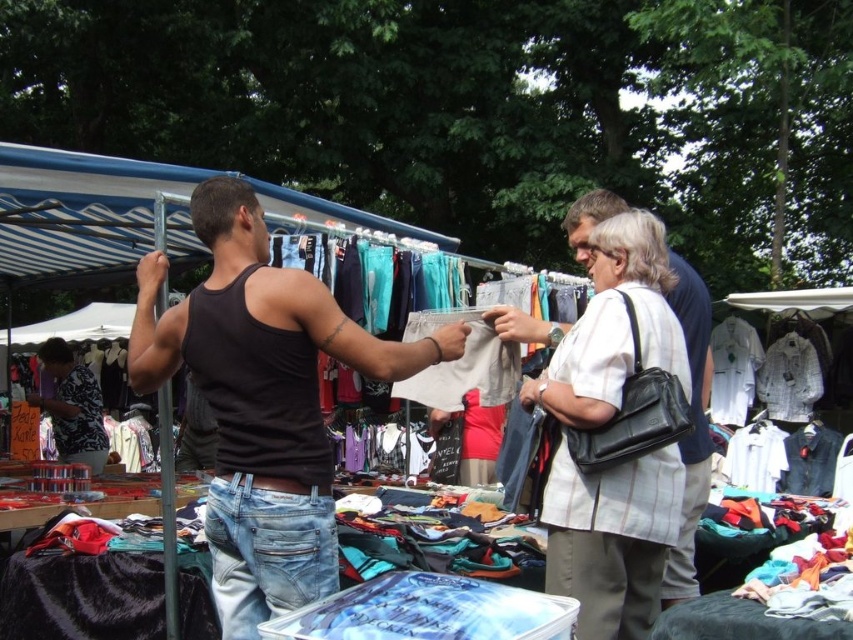
Between point (276, 435) and point (576, 426), which one is positioned in front?

Point (276, 435) is in front.

Between point (241, 528) and point (529, 385), which one is positioned behind?

The point (529, 385) is behind.

Is point (223, 461) behind point (669, 468)?

No, (223, 461) is in front of (669, 468).

Identify the location of black matte tank top at center. (262, 401).

Does white striped shirt at center appear over white cotton shirt at center right?

Correct, white striped shirt at center is located above white cotton shirt at center right.

Does point (651, 321) come closer to viewer compared to point (721, 323)?

That is True.

Is point (631, 243) farther from camera compared to point (718, 365)?

No, (631, 243) is in front of (718, 365).

Find the location of a particular element. The image size is (853, 640). white striped shirt at center is located at coordinates (607, 422).

From the picture: Which is above, black matte tank top at center or white cotton shirt at center right?

Positioned higher is black matte tank top at center.

Can you confirm if black matte tank top at center is wider than white cotton shirt at center right?

Correct, the width of black matte tank top at center exceeds that of white cotton shirt at center right.

Identify the location of black matte tank top at center. (262, 401).